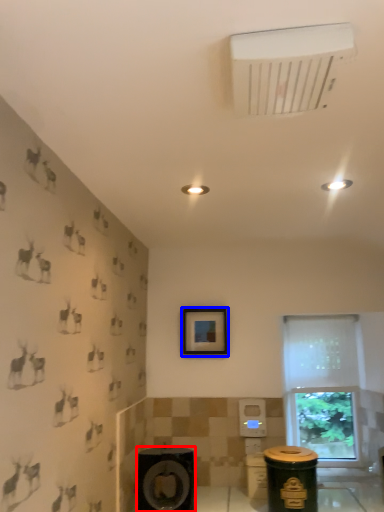
Question: Which of the following is the farthest to the observer, speaker (highlighted by a red box) or picture frame (highlighted by a blue box)?

Choices:
 (A) speaker
 (B) picture frame

Answer: (B)